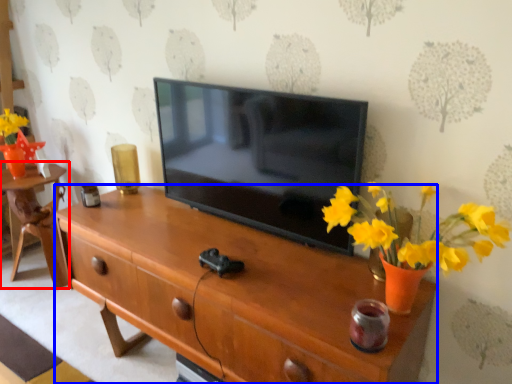
Question: Which of the following is the farthest to the observer, table (highlighted by a red box) or desk (highlighted by a blue box)?

Choices:
 (A) table
 (B) desk

Answer: (A)